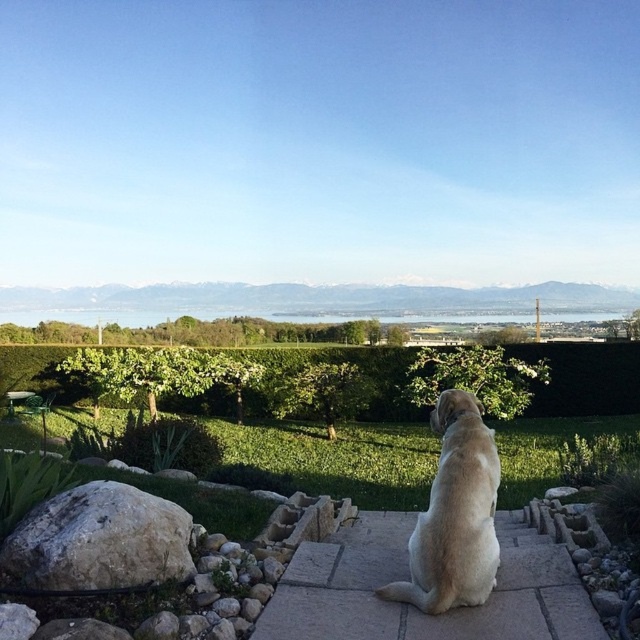
Question: Estimate the real-world distances between objects in this image. Which object is closer to the green leafy hedge at center?

Choices:
 (A) beige stone steps at center
 (B) white rough rock at lower left
 (C) light brown fur at center

Answer: (C)

Question: Among these points, which one is farthest from the camera?

Choices:
 (A) (531, 410)
 (B) (440, 397)
 (C) (3, 544)
 (D) (586, 624)

Answer: (A)

Question: Is green leafy hedge at center wider than light brown fur at center?

Choices:
 (A) yes
 (B) no

Answer: (A)

Question: Can you confirm if beige stone steps at center is positioned above light brown fur at center?

Choices:
 (A) no
 (B) yes

Answer: (A)

Question: Which object is closer to the camera taking this photo?

Choices:
 (A) light brown fur at center
 (B) green leafy hedge at center

Answer: (A)

Question: Does white rough rock at lower left have a lesser width compared to light brown fur at center?

Choices:
 (A) no
 (B) yes

Answer: (A)